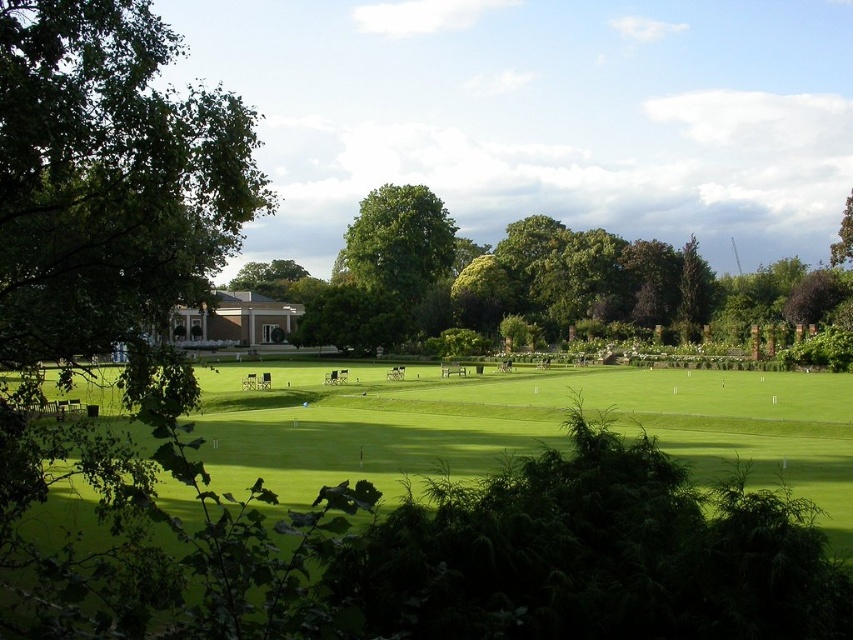
You are planning to set up a picnic blanket in the park. You have two options for placement near the green grassy field at center and the green leafy tree at center. Which location would be closer to the tree if you place the blanket on the right side of the field?

The green grassy field at center is positioned on the right side of green leafy tree at center, so placing the blanket on the right side of the field would mean it is further away from the tree. To be closer to the tree, you should place the blanket on the left side of the field instead.